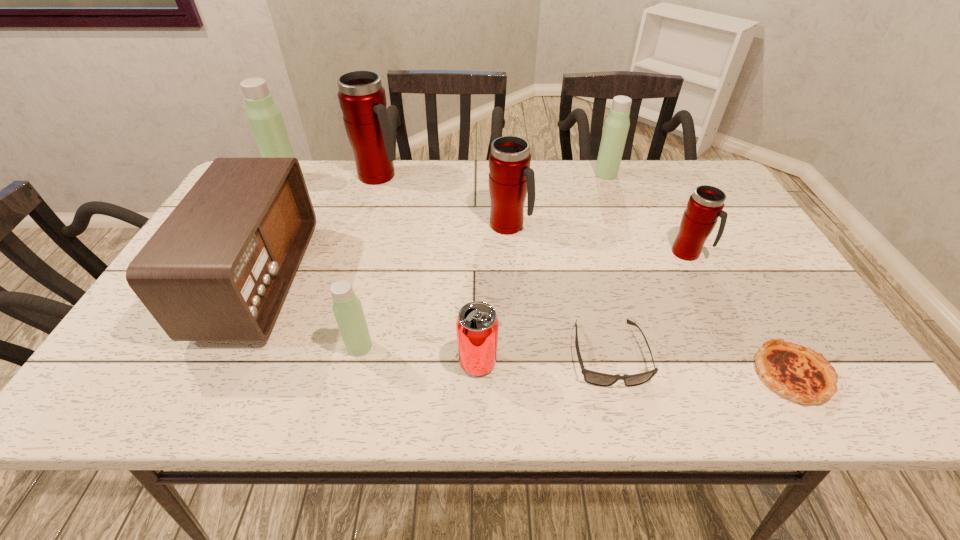
The height and width of the screenshot is (540, 960). What are the coordinates of `free spot located 0.230m on the right of the second smallest light thermos bottle` in the screenshot? It's located at (690, 174).

Find the location of a particular element. vacant space located 0.320m on the side with the handle of the second red thermos bottle from right to left is located at coordinates (647, 226).

Identify the location of blank space located 0.280m on the front-facing side of the brown radio receiver. This screenshot has height=540, width=960. (415, 281).

This screenshot has width=960, height=540. Identify the location of free space located on the left of the smallest light thermos bottle. (227, 346).

I want to click on free space located 0.070m on the side with the handle of the second nearest thermos bottle, so 732,253.

Identify the location of vacant region located 0.080m on the left of the red soda can. (419, 362).

Identify the location of free space located 0.080m on the back of the quiche. (758, 316).

The height and width of the screenshot is (540, 960). Identify the location of soda can situated at the near edge. (477, 324).

This screenshot has width=960, height=540. Identify the location of sunglasses located at the near edge. (595, 378).

The image size is (960, 540). Identify the location of quiche at the near edge. (794, 371).